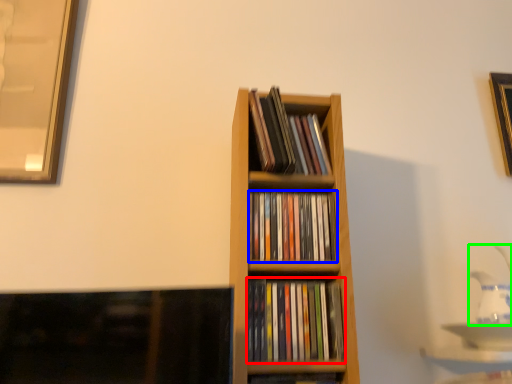
Question: Estimate the real-world distances between objects in this image. Which object is closer to book (highlighted by a red box), book (highlighted by a blue box) or tea pot (highlighted by a green box)?

Choices:
 (A) book
 (B) tea pot

Answer: (A)